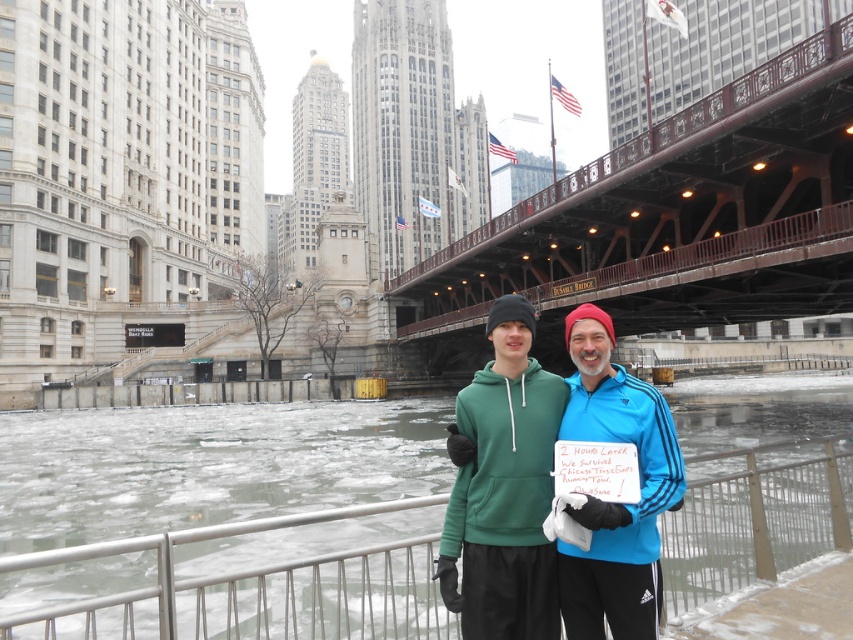
Question: Which of these objects is positioned closest to the green fleece jacket at center?

Choices:
 (A) frozen ice at center
 (B) brown wooden bridge at center

Answer: (B)

Question: Does frozen ice at center appear on the left side of green fleece jacket at center?

Choices:
 (A) yes
 (B) no

Answer: (A)

Question: Considering the relative positions of frozen ice at center and brown wooden bridge at center in the image provided, where is frozen ice at center located with respect to brown wooden bridge at center?

Choices:
 (A) above
 (B) below

Answer: (B)

Question: Which object appears closest to the camera in this image?

Choices:
 (A) frozen ice at center
 (B) brown wooden bridge at center

Answer: (A)

Question: Which of the following is the farthest from the observer?

Choices:
 (A) brown wooden bridge at center
 (B) green fleece jacket at center
 (C) frozen ice at center

Answer: (A)

Question: Observing the image, what is the correct spatial positioning of brown wooden bridge at center in reference to green fleece jacket at center?

Choices:
 (A) left
 (B) right

Answer: (B)